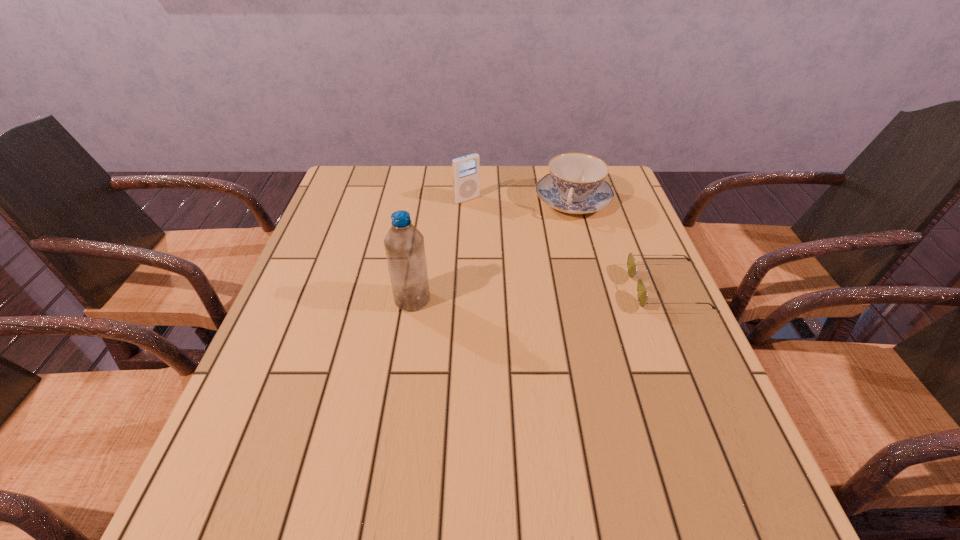
Locate an element on the screen. The image size is (960, 540). blank area in the image that satisfies the following two spatial constraints: 1. on the back side of the shortest object; 2. on the front-facing side of the water bottle is located at coordinates (414, 288).

You are a GUI agent. You are given a task and a screenshot of the screen. Output one action in this format:
    pyautogui.click(x=<x>, y=<y>)
    Task: Click on the free location that satisfies the following two spatial constraints: 1. on the back side of the shortest object; 2. on the front-facing side of the water bottle
    The height and width of the screenshot is (540, 960).
    Given the screenshot: What is the action you would take?
    pyautogui.click(x=414, y=288)

Where is `free space that satisfies the following two spatial constraints: 1. on the back side of the third shortest object; 2. on the left side of the water bottle`? Image resolution: width=960 pixels, height=540 pixels. free space that satisfies the following two spatial constraints: 1. on the back side of the third shortest object; 2. on the left side of the water bottle is located at coordinates (428, 200).

Where is `free location that satisfies the following two spatial constraints: 1. on the front side of the sunglasses; 2. on the front-facing side of the third shortest object`? free location that satisfies the following two spatial constraints: 1. on the front side of the sunglasses; 2. on the front-facing side of the third shortest object is located at coordinates (464, 288).